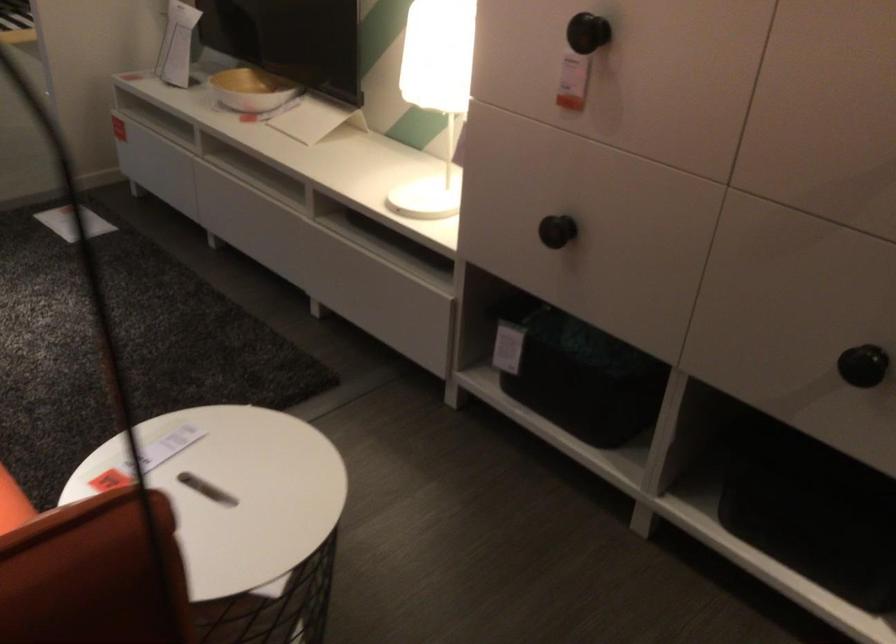
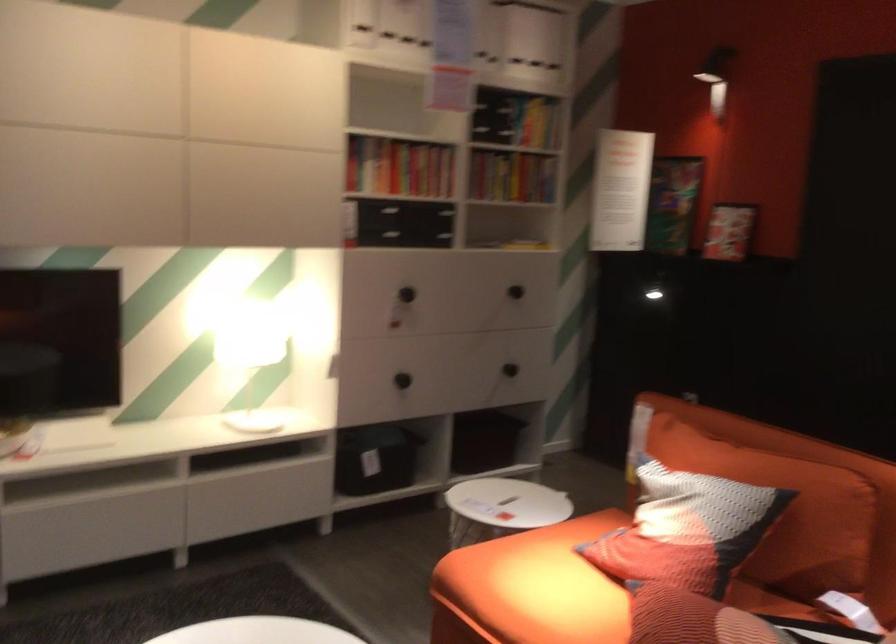
Locate, in the second image, the point that corresponds to [530,230] in the first image.

(401, 380)